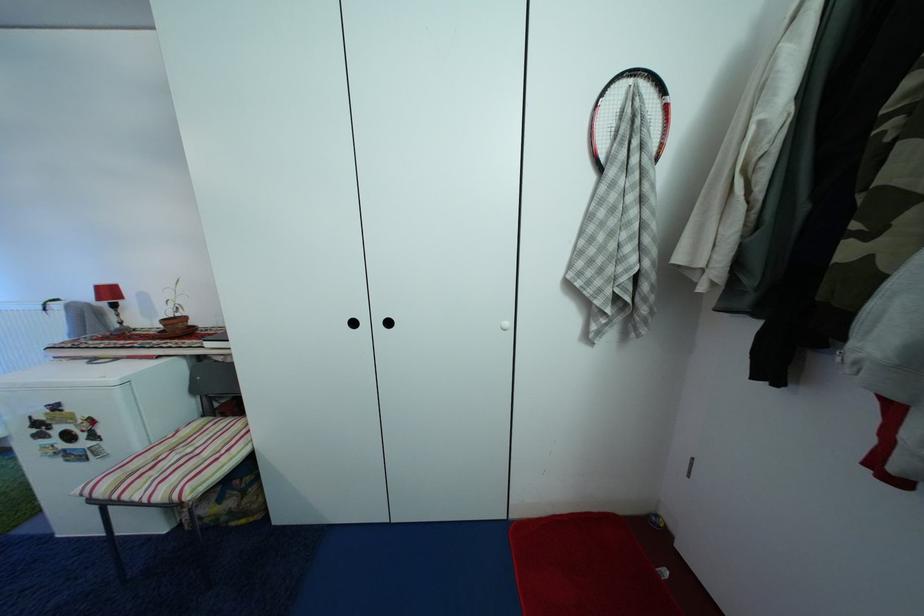
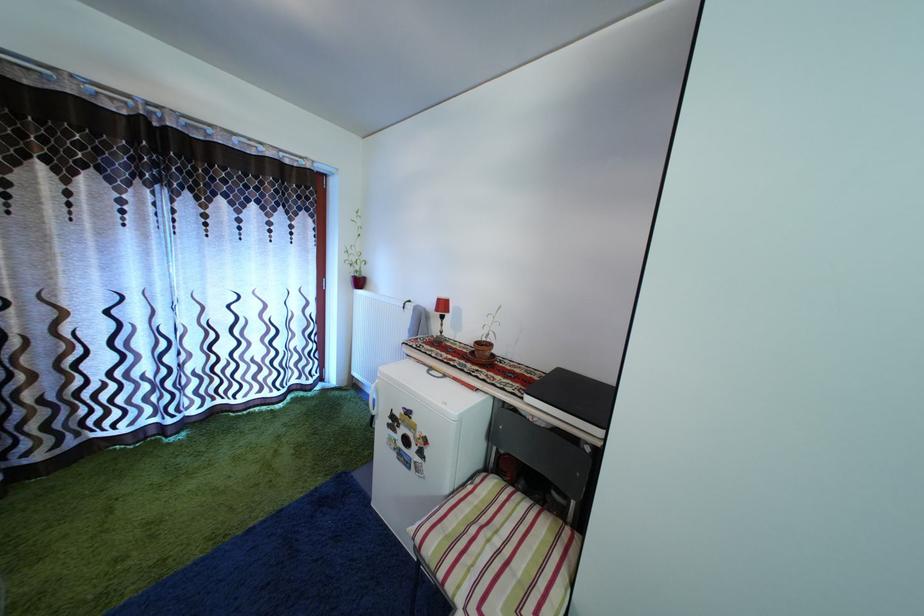
Find the pixel in the second image that matches the point at 174,326 in the first image.

(485, 350)